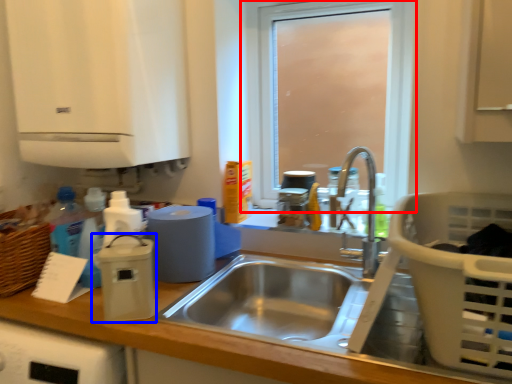
Question: Which object appears farthest to the camera in this image, window (highlighted by a red box) or appliance (highlighted by a blue box)?

Choices:
 (A) window
 (B) appliance

Answer: (A)